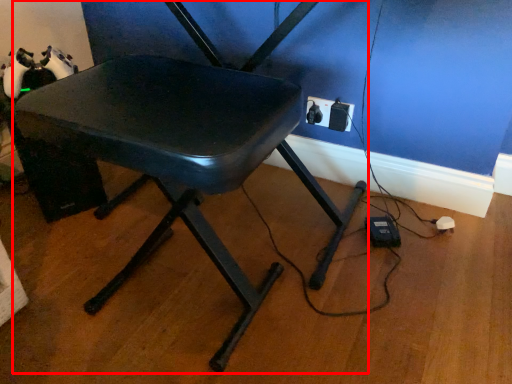
Question: Considering the relative positions of chair (annotated by the red box) and electric outlet in the image provided, where is chair (annotated by the red box) located with respect to the staircase?

Choices:
 (A) left
 (B) right

Answer: (A)